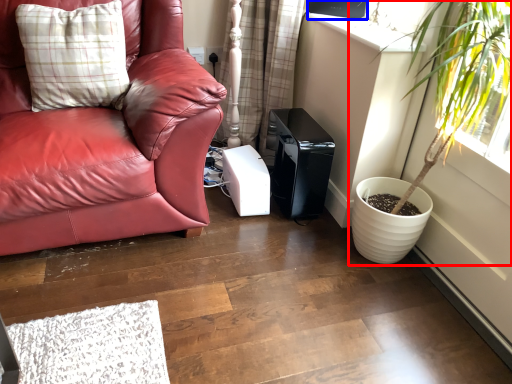
Question: Among these objects, which one is nearest to the camera, houseplant (highlighted by a red box) or window screen (highlighted by a blue box)?

Choices:
 (A) houseplant
 (B) window screen

Answer: (A)